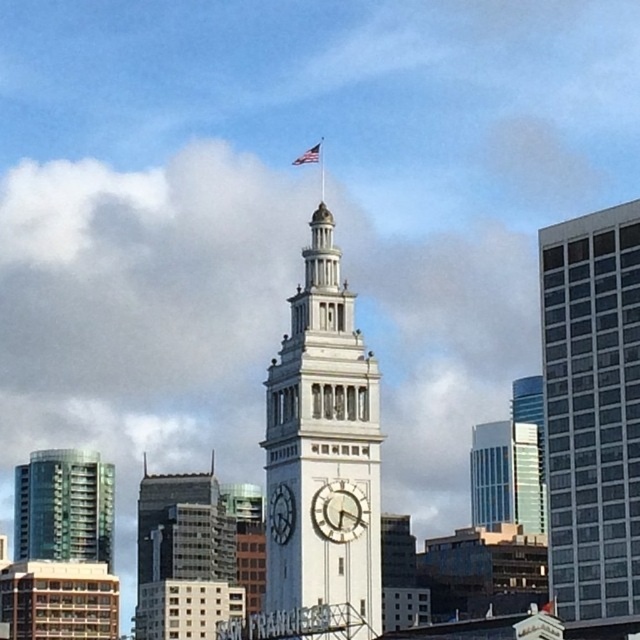
Does gold metallic clock at center have a greater width compared to american flag at upper center?

Incorrect, gold metallic clock at center's width does not surpass american flag at upper center's.

Is point (358, 518) behind point (317, 141)?

No, (358, 518) is in front of (317, 141).

Identify the location of gold metallic clock at center. (339, 512).

Is black glass building at center thinner than gold metallic clock at center?

No.

Where is `black glass building at center`? The width and height of the screenshot is (640, 640). black glass building at center is located at coordinates (184, 557).

The image size is (640, 640). Describe the element at coordinates (184, 557) in the screenshot. I see `black glass building at center` at that location.

Locate an element on the screen. Image resolution: width=640 pixels, height=640 pixels. black glass building at center is located at coordinates (184, 557).

Measure the distance between white glass building at right and camera.

white glass building at right and camera are 445.95 feet apart.

Can you confirm if white glass building at right is positioned to the right of dark gray stone clock at center?

Correct, you'll find white glass building at right to the right of dark gray stone clock at center.

Is point (611, 416) positioned in front of point (273, 500)?

That is False.

Where is `white glass building at right`? white glass building at right is located at coordinates (592, 410).